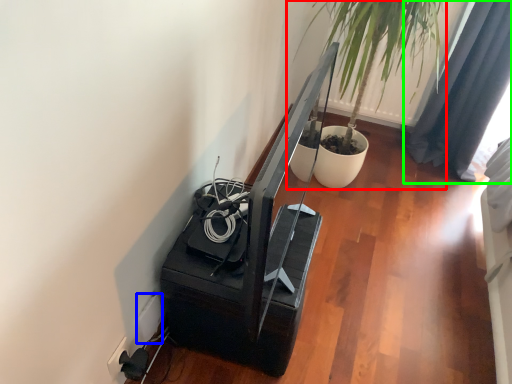
Question: Considering the real-world distances, which object is closest to houseplant (highlighted by a red box)? electric outlet (highlighted by a blue box) or curtain (highlighted by a green box).

Choices:
 (A) electric outlet
 (B) curtain

Answer: (B)